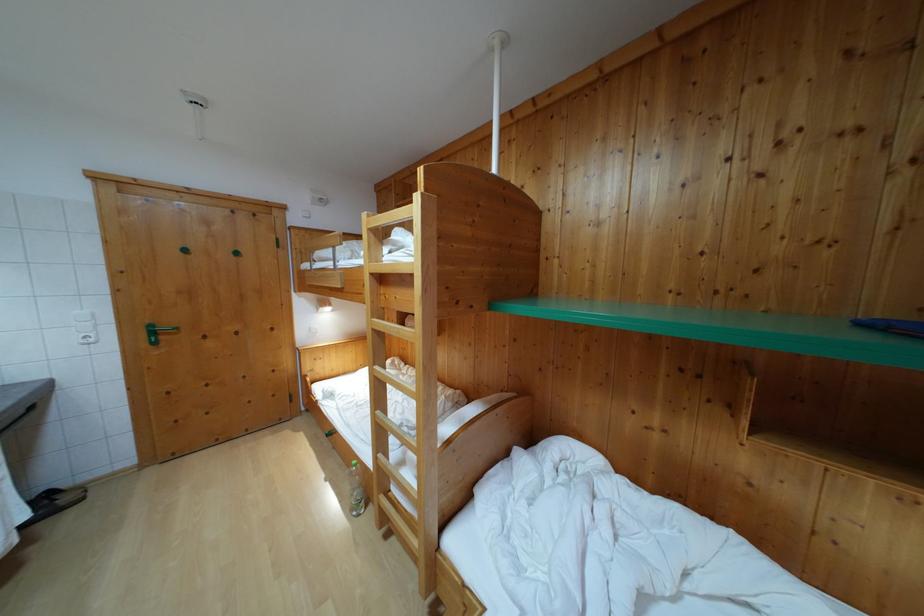
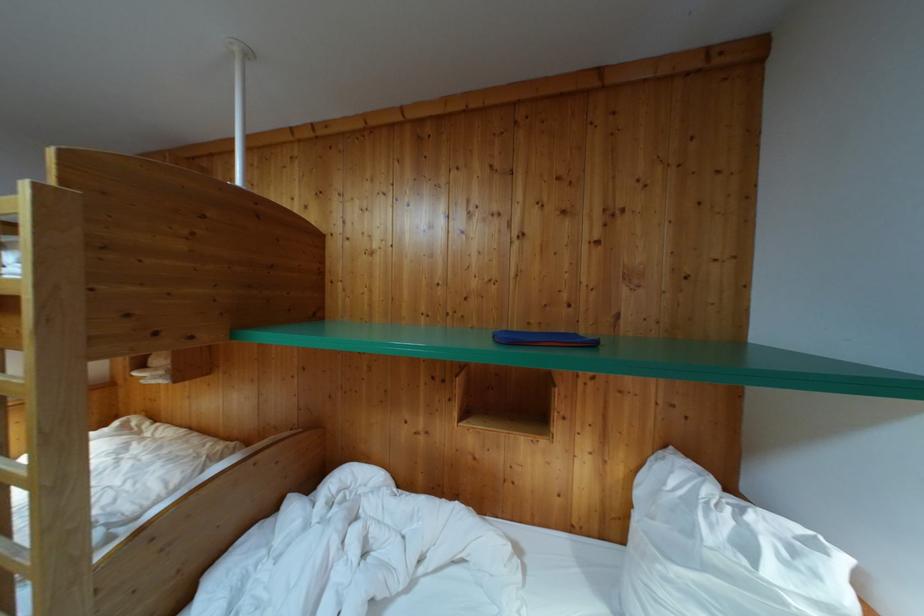
Question: Based on the continuous images, in which direction is the camera rotating? Reply with the corresponding letter.

Choices:
 (A) Left
 (B) Right
 (C) Up
 (D) Down

Answer: (B)